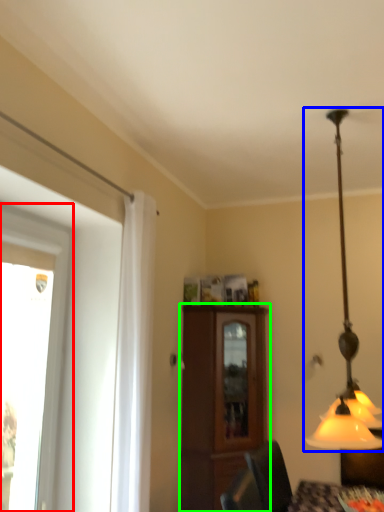
Question: Which object is positioned closest to window (highlighted by a red box)? Select from lamp (highlighted by a blue box) and cabinetry (highlighted by a green box).

Choices:
 (A) lamp
 (B) cabinetry

Answer: (B)